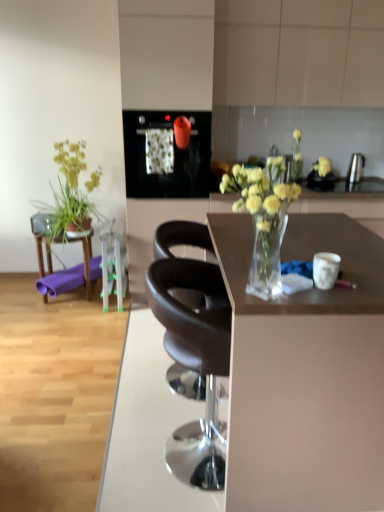
Locate an element on the screen. This screenshot has width=384, height=512. green plastic bar stool at center is located at coordinates click(x=112, y=268).

Measure the distance between point (353,161) and camera.

Point (353,161) is 11.16 feet away from camera.

What do you see at coordinates (355, 168) in the screenshot? I see `satin silver kettle at upper right, which is the first appliance from right to left` at bounding box center [355, 168].

What is the approximate width of green leafy plant at left?

The width of green leafy plant at left is 19.32 centimeters.

The height and width of the screenshot is (512, 384). What do you see at coordinates (299, 52) in the screenshot? I see `white tile cabinetry at upper center` at bounding box center [299, 52].

The width and height of the screenshot is (384, 512). What are the coordinates of `green plastic bar stool at center` in the screenshot? It's located at (112, 268).

Is green leafy plant at left oriented away from clear glass vase at center?

No, green leafy plant at left is not facing away from clear glass vase at center.

Considering the sizes of objects green leafy plant at left and clear glass vase at center in the image provided, who is shorter, green leafy plant at left or clear glass vase at center?

With less height is clear glass vase at center.

Where is `desk behind the clear glass vase at center`? The image size is (384, 512). desk behind the clear glass vase at center is located at coordinates (305, 373).

Is point (238, 403) positioned in front of point (267, 168)?

No.

Is matte brown desk at center far away from clear glass vase at center?

No.

Is matte brown desk at center behind clear glass vase at center?

Yes, the depth of matte brown desk at center is greater than that of clear glass vase at center.

From a real-world perspective, is matte black oven at upper center, which is counted as the first appliance, starting from the left, positioned over clear glass vase at center based on gravity?

No.

Considering the sizes of matte black oven at upper center, which is counted as the first appliance, starting from the left, and clear glass vase at center in the image, is matte black oven at upper center, which is counted as the first appliance, starting from the left, taller or shorter than clear glass vase at center?

Clearly, matte black oven at upper center, which is counted as the first appliance, starting from the left, is taller compared to clear glass vase at center.

This screenshot has height=512, width=384. Identify the location of appliance that appears on the left of clear glass vase at center. (173, 156).

Based on their positions, is matte black oven at upper center, which is counted as the first appliance, starting from the left, located to the left or right of clear glass vase at center?

Based on their positions, matte black oven at upper center, which is counted as the first appliance, starting from the left, is located to the left of clear glass vase at center.

Based on the photo, which is more to the left, green plastic bar stool at center or matte brown chair at center, which is the 2th chair in back-to-front order?

From the viewer's perspective, green plastic bar stool at center appears more on the left side.

Consider the image. From a real-world perspective, which object rests below the other?

In real-world perspective, green plastic bar stool at center is lower.

Does point (122, 278) appear closer or farther from the camera than point (218, 287)?

Point (122, 278).

Does green plastic bar stool at center come behind matte brown chair at center, the first chair viewed from the front?

Yes, green plastic bar stool at center is behind matte brown chair at center, the first chair viewed from the front.

Does point (215, 369) lie in front of point (85, 249)?

Yes, point (215, 369) is closer to viewer.

Is there a large distance between black leather chair at center, positioned as the first chair in back-to-front order, and purple rubber mat at left?

Yes.

This screenshot has height=512, width=384. Identify the location of table below the black leather chair at center, the 2th chair from the front (from a real-world perspective). (65, 269).

From a real-world perspective, does matte brown desk at center sit lower than white tile cabinetry at upper center?

Yes, from a real-world perspective, matte brown desk at center is beneath white tile cabinetry at upper center.

From the image's perspective, is matte brown desk at center on white tile cabinetry at upper center?

No.

Is matte brown desk at center not near white tile cabinetry at upper center?

matte brown desk at center is far away from white tile cabinetry at upper center.

Is matte brown desk at center taller than white tile cabinetry at upper center?

Yes, matte brown desk at center is taller than white tile cabinetry at upper center.

Is the surface of satin silver kettle at upper right, arranged as the second appliance when viewed from the front, in direct contact with green leafy plant at left?

No, satin silver kettle at upper right, arranged as the second appliance when viewed from the front, is not making contact with green leafy plant at left.

From the image's perspective, relative to green leafy plant at left, is satin silver kettle at upper right, arranged as the second appliance when viewed from the front, above or below?

From the image's perspective, satin silver kettle at upper right, arranged as the second appliance when viewed from the front, appears above green leafy plant at left.

Does point (352, 176) come in front of point (48, 221)?

That is False.

The height and width of the screenshot is (512, 384). Identify the location of appliance that is behind the green leafy plant at left. (355, 168).

At what (x,y) coordinates should I click in order to perform the action: click on houseplant that is above the clear glass vase at center (from the image's perspective). Please return your answer as a coordinate pair (x, y). The height and width of the screenshot is (512, 384). Looking at the image, I should click on (71, 194).

In the image, there is a clear glass vase at center. Identify the location of desk below it (from a real-world perspective). This screenshot has width=384, height=512. (305, 373).

Based on their spatial positions, is green leafy plant at left or clear glass vase at center closer to matte brown chair at center, the first chair viewed from the front?

clear glass vase at center lies closer to matte brown chair at center, the first chair viewed from the front, than the other object.

Which object lies further to the anchor point matte black oven at upper center, which is counted as the first appliance, starting from the left, satin silver kettle at upper right, which is the 1th appliance from back to front, or matte brown desk at center?

Based on the image, matte brown desk at center appears to be further to matte black oven at upper center, which is counted as the first appliance, starting from the left.

Consider the image. From the image, which object appears to be nearer to purple rubber mat at left, clear glass vase at center or matte brown desk at center?

Based on the image, clear glass vase at center appears to be nearer to purple rubber mat at left.

Looking at this image, which object lies further to the anchor point green leafy plant at left, satin silver kettle at upper right, arranged as the second appliance when viewed from the front, or matte brown chair at center, the first chair viewed from the front?

satin silver kettle at upper right, arranged as the second appliance when viewed from the front.

When comparing their distances from green plastic bar stool at center, does satin silver kettle at upper right, which is the first appliance from right to left, or green leafy plant at left seem closer?

green leafy plant at left.

From the image, which object appears to be farther from white tile cabinetry at upper center, clear glass vase at center or green leafy plant at left?

clear glass vase at center lies further to white tile cabinetry at upper center than the other object.

When comparing their distances from matte brown chair at center, the first chair viewed from the front, does purple rubber mat at left or green plastic bar stool at center seem further?

purple rubber mat at left lies further to matte brown chair at center, the first chair viewed from the front, than the other object.

Which object lies nearer to the anchor point satin silver kettle at upper right, which is the 1th appliance from back to front, black leather chair at center, the 2th chair from the front, or matte black oven at upper center, the 1th appliance positioned from the front?

The object closer to satin silver kettle at upper right, which is the 1th appliance from back to front, is matte black oven at upper center, the 1th appliance positioned from the front.

Find the location of `appliance between matte brown desk at center and green plastic bar stool at center along the z-axis`. appliance between matte brown desk at center and green plastic bar stool at center along the z-axis is located at coordinates 173,156.

Identify the location of houseplant between white tile cabinetry at upper center and black leather chair at center, positioned as the first chair in back-to-front order, vertically. (71, 194).

I want to click on appliance between matte brown chair at center, the first chair viewed from the front, and satin silver kettle at upper right, which is counted as the second appliance, starting from the left, from front to back, so click(173, 156).

Find the location of a particular element. The width and height of the screenshot is (384, 512). table that lies between white tile cabinetry at upper center and matte brown chair at center, the first chair viewed from the front, from top to bottom is located at coordinates (65, 269).